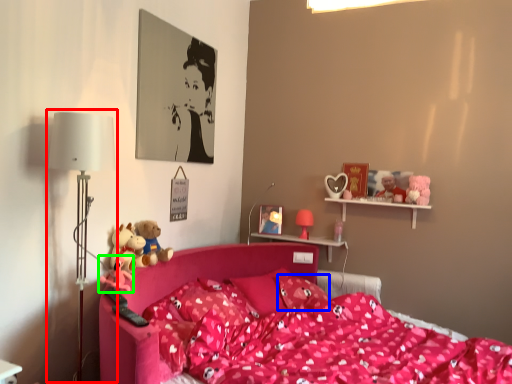
Question: Based on their relative distances, which object is farther from table lamp (highlighted by a red box)? Choose from pillow (highlighted by a blue box) and toy (highlighted by a green box).

Choices:
 (A) pillow
 (B) toy

Answer: (A)